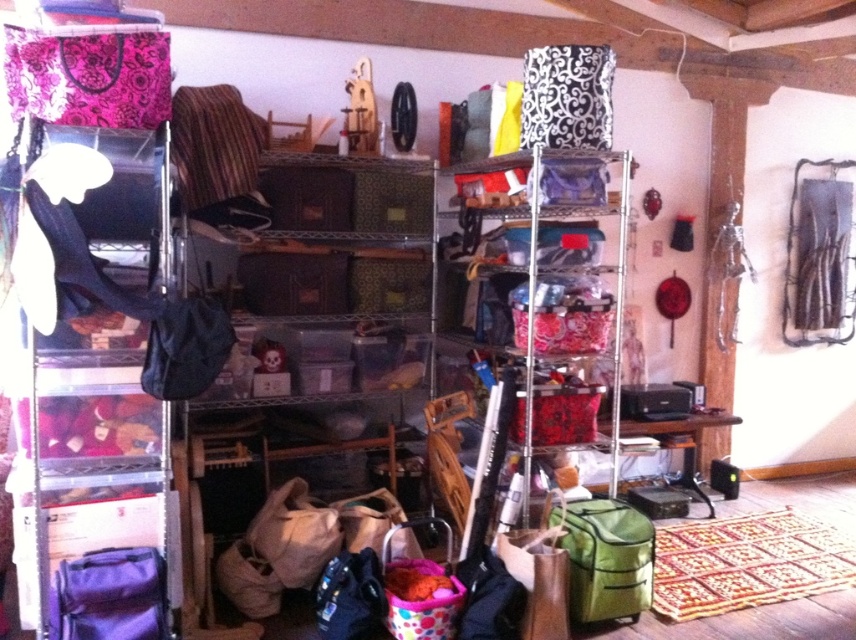
Between green fabric bag at lower right and matte beige fabric bag at lower center, which one is positioned lower?

green fabric bag at lower right is lower down.

Between point (575, 556) and point (316, 564), which one is positioned behind?

The point (316, 564) is more distant.

Measure the distance between point (627, 577) and camera.

2.68 meters

Locate an element on the screen. Image resolution: width=856 pixels, height=640 pixels. green fabric bag at lower right is located at coordinates (605, 557).

In the scene shown: Which is below, green fabric bag at lower right or matte purple duffel at lower left?

green fabric bag at lower right is lower down.

Which of these two, green fabric bag at lower right or matte purple duffel at lower left, stands taller?

green fabric bag at lower right is taller.

Between point (642, 529) and point (146, 564), which one is positioned behind?

Point (642, 529)

At what (x,y) coordinates should I click in order to perform the action: click on green fabric bag at lower right. Please return your answer as a coordinate pair (x, y). This screenshot has height=640, width=856. Looking at the image, I should click on (605, 557).

Is matte purple duffel at lower left to the right of matte beige fabric bag at lower center from the viewer's perspective?

No, matte purple duffel at lower left is not to the right of matte beige fabric bag at lower center.

Can you confirm if matte purple duffel at lower left is taller than matte beige fabric bag at lower center?

No, matte purple duffel at lower left is not taller than matte beige fabric bag at lower center.

Which is behind, point (116, 600) or point (293, 529)?

Positioned behind is point (293, 529).

Find the location of a particular element. This screenshot has height=640, width=856. matte purple duffel at lower left is located at coordinates (110, 595).